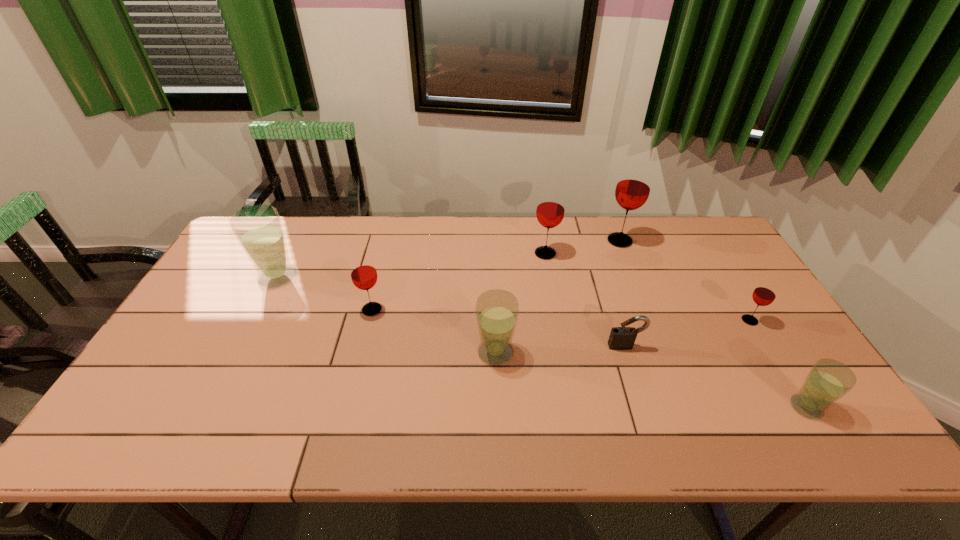
Select which glass is the fourth closest to the padlock. Please provide its 2D coordinates. Your answer should be formatted as a tuple, i.e. [(x, y)], where the tuple contains the x and y coordinates of a point satisfying the conditions above.

[(550, 211)]

I want to click on glass that stands as the seventh closest to the shortest object, so click(258, 229).

Locate which red glass ranks fourth in proximity to the leftmost blue glass. Please provide its 2D coordinates. Your answer should be formatted as a tuple, i.e. [(x, y)], where the tuple contains the x and y coordinates of a point satisfying the conditions above.

[(764, 294)]

Locate an element on the screen. The width and height of the screenshot is (960, 540). red glass that is the second nearest to the biggest red glass is located at coordinates (764, 294).

Identify the location of blue glass that is the closest one to the sixth glass from right to left. (258, 229).

Find the location of a particular element. blue glass that can be found as the second closest to the third glass from left to right is located at coordinates (828, 380).

Where is `vacant space that satisfies the following two spatial constraints: 1. with the keyhole on the front of the padlock; 2. on the right side of the nearest object`? vacant space that satisfies the following two spatial constraints: 1. with the keyhole on the front of the padlock; 2. on the right side of the nearest object is located at coordinates (644, 407).

Identify the location of free space that satisfies the following two spatial constraints: 1. with the keyhole on the front of the rightmost blue glass; 2. on the left side of the padlock. This screenshot has height=540, width=960. (644, 407).